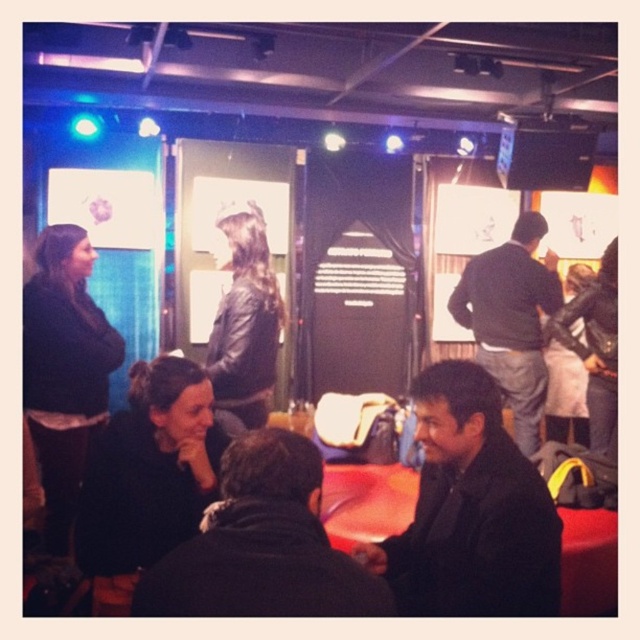
Question: Which is nearer to the dark gray sweater at center?

Choices:
 (A) black matte jacket at lower right
 (B) dark brown leather jacket at lower center

Answer: (A)

Question: Based on their relative distances, which object is nearer to the black matte jacket at lower right?

Choices:
 (A) dark brown leather jacket at lower center
 (B) dark gray sweater at center

Answer: (A)

Question: Is dark brown leather jacket at lower center to the right of dark gray sweater at center from the viewer's perspective?

Choices:
 (A) no
 (B) yes

Answer: (A)

Question: Does black matte jacket at lower right appear on the right side of dark brown leather jacket at lower center?

Choices:
 (A) yes
 (B) no

Answer: (A)

Question: Considering the relative positions of dark brown leather jacket at lower center and dark gray sweater at center in the image provided, where is dark brown leather jacket at lower center located with respect to dark gray sweater at center?

Choices:
 (A) left
 (B) right

Answer: (A)

Question: Which object is the closest to the dark brown leather jacket at lower center?

Choices:
 (A) black matte jacket at lower right
 (B) dark gray sweater at center

Answer: (A)